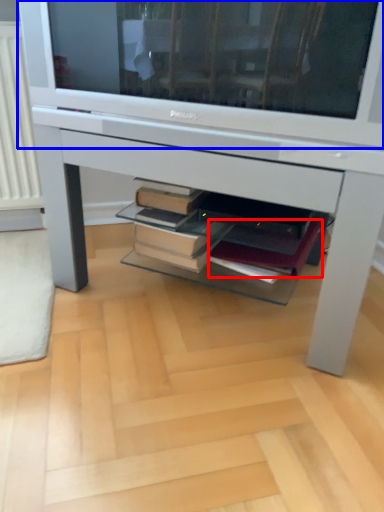
Question: Which of the following is the closest to the observer, paperback book (highlighted by a red box) or television (highlighted by a blue box)?

Choices:
 (A) paperback book
 (B) television

Answer: (B)